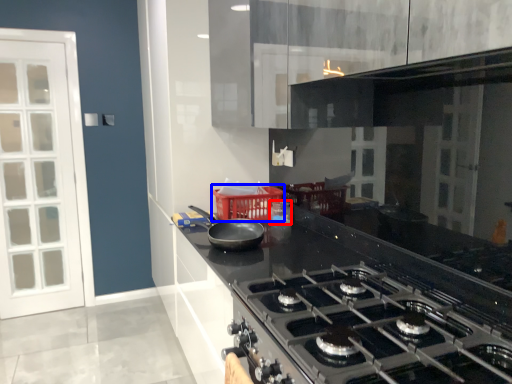
Question: Which of the following is the farthest to the observer, appliance (highlighted by a red box) or basket (highlighted by a blue box)?

Choices:
 (A) appliance
 (B) basket

Answer: (A)